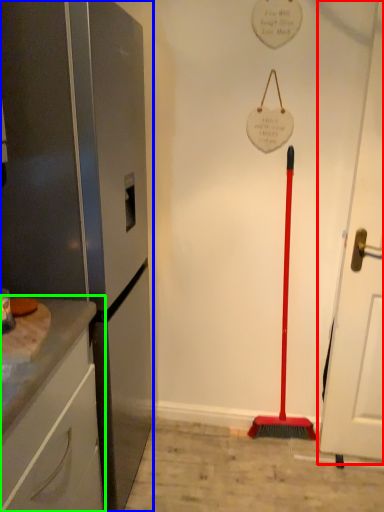
Question: Estimate the real-world distances between objects in this image. Which object is farther from door (highlighted by a red box), appliance (highlighted by a blue box) or cabinetry (highlighted by a green box)?

Choices:
 (A) appliance
 (B) cabinetry

Answer: (B)